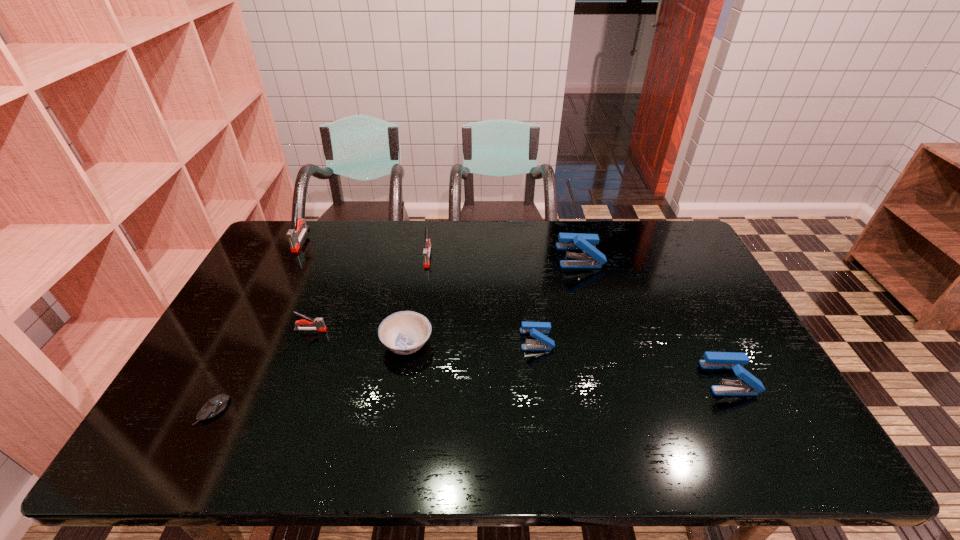
Where is `free location at the right edge`? free location at the right edge is located at coordinates (709, 276).

Locate an element on the screen. Image resolution: width=960 pixels, height=540 pixels. vacant space at the far right corner of the desktop is located at coordinates (685, 239).

At what (x,y) coordinates should I click in order to perform the action: click on free point between the biggest gray stapler and the rightmost gray stapler. Please return your answer as a coordinate pair (x, y). Image resolution: width=960 pixels, height=540 pixels. Looking at the image, I should click on (365, 248).

Where is `free space between the leftmost blue stapler and the blue bowl`? This screenshot has height=540, width=960. free space between the leftmost blue stapler and the blue bowl is located at coordinates (471, 341).

The height and width of the screenshot is (540, 960). Identify the location of vacant area that lies between the second smallest blue stapler and the bowl. (568, 361).

I want to click on unoccupied position between the fourth stapler from right to left and the farthest blue stapler, so click(504, 256).

I want to click on unoccupied position between the biggest blue stapler and the rightmost gray stapler, so click(x=504, y=256).

Where is `vacant area that lies between the biggest gray stapler and the second shortest object`? Image resolution: width=960 pixels, height=540 pixels. vacant area that lies between the biggest gray stapler and the second shortest object is located at coordinates (354, 292).

This screenshot has width=960, height=540. Identify the location of free spot between the rightmost blue stapler and the leftmost blue stapler. (633, 359).

This screenshot has width=960, height=540. What are the coordinates of `free space that is in between the leftmost blue stapler and the rightmost gray stapler` in the screenshot? It's located at (482, 298).